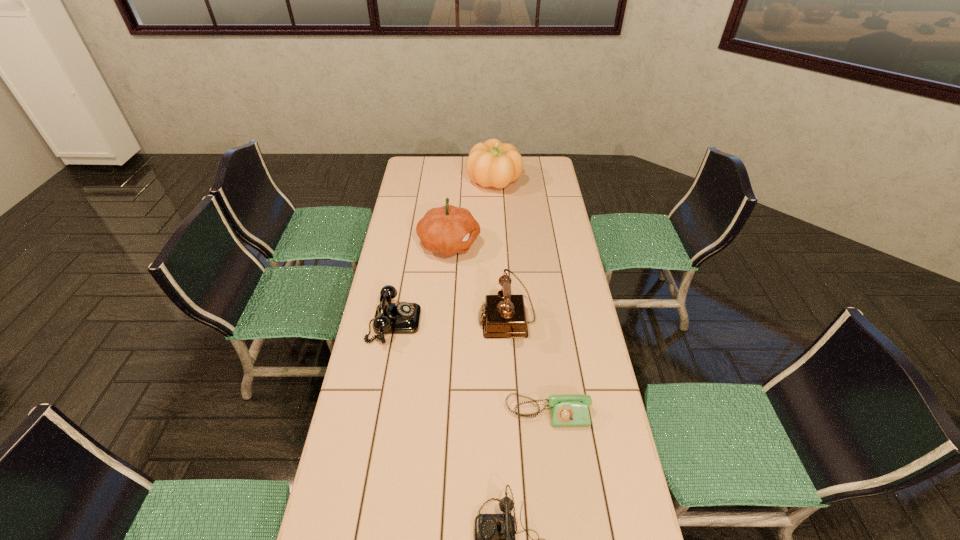
Identify the location of the farthest object. The image size is (960, 540). (492, 163).

Locate an element on the screen. the second farthest object is located at coordinates (447, 230).

Locate an element on the screen. the third tallest object is located at coordinates (503, 316).

The height and width of the screenshot is (540, 960). Identify the location of the third shortest telephone. (390, 318).

In order to click on the leftmost telephone in this screenshot , I will do `click(390, 318)`.

The width and height of the screenshot is (960, 540). Find the location of `the fifth farthest object`. the fifth farthest object is located at coordinates (566, 410).

Where is `free spot located on the front of the farther pumpkin`? The width and height of the screenshot is (960, 540). free spot located on the front of the farther pumpkin is located at coordinates (495, 215).

At what (x,y) coordinates should I click in order to perform the action: click on vacant space located on the front face of the second farthest object. Please return your answer as a coordinate pair (x, y). Looking at the image, I should click on (569, 244).

What are the coordinates of `free space located 0.080m on the dial of the fourth shortest object` in the screenshot? It's located at (457, 318).

Find the location of a particular element. The width and height of the screenshot is (960, 540). free spot located on the dial of the fourth shortest object is located at coordinates (402, 318).